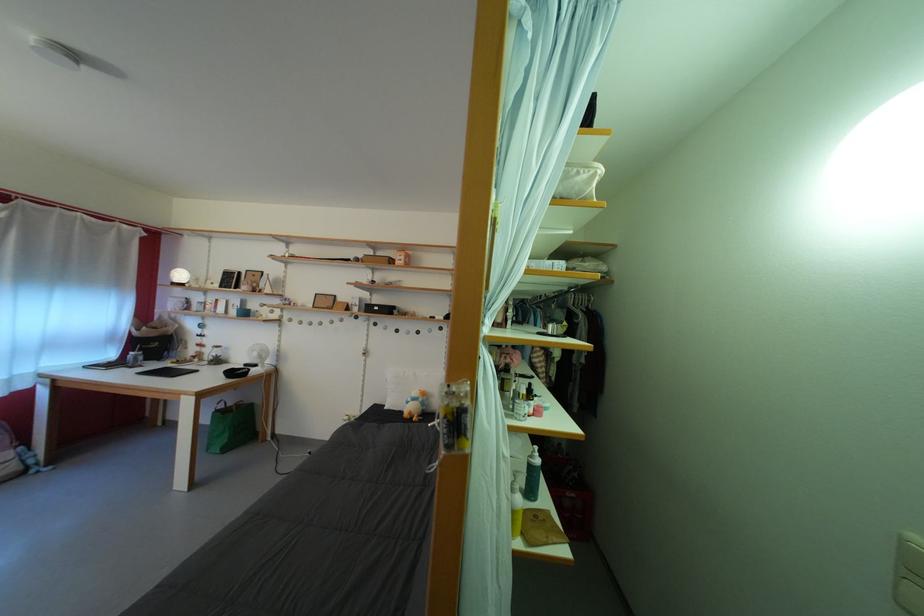
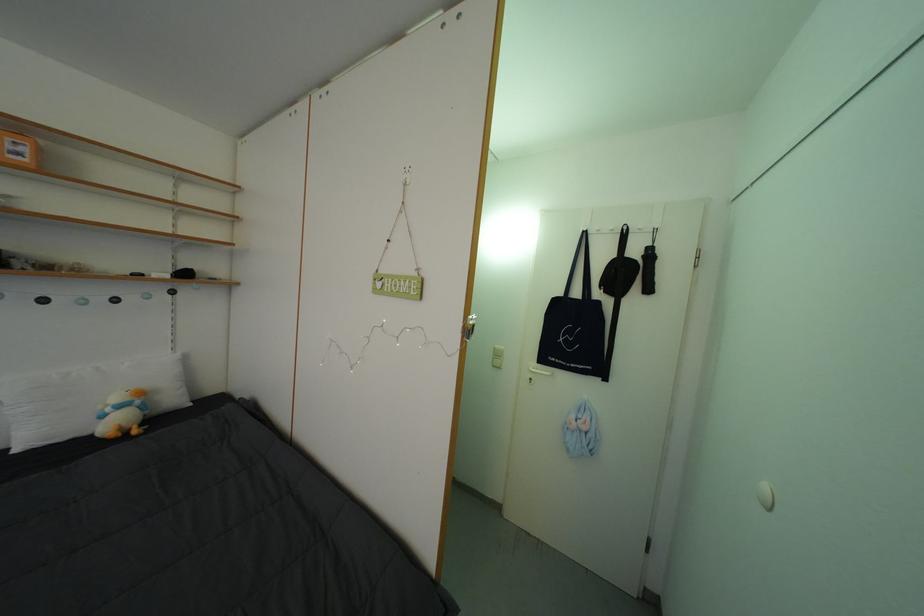
Where in the second image is the point corresponding to [418,405] from the first image?

(117, 415)